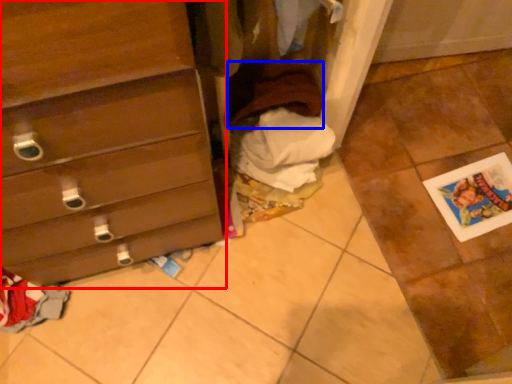
Question: Which of the following is the farthest to the observer, chest of drawers (highlighted by a red box) or clothing (highlighted by a blue box)?

Choices:
 (A) chest of drawers
 (B) clothing

Answer: (B)